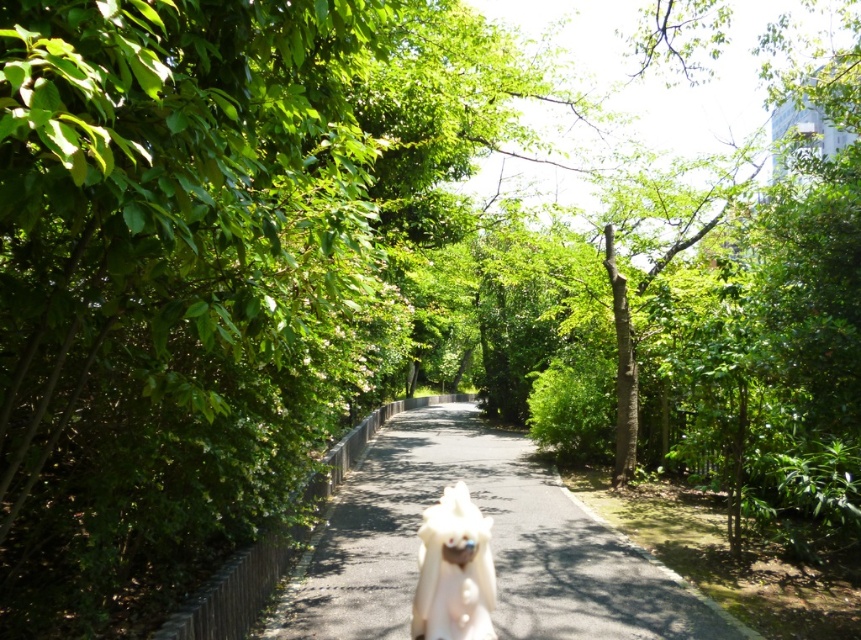
You are a child who wants to pick up both the white fabric dog at center and the white fur dog at center from the path. Which one do you need to bend down more to reach?

The white fur dog at center requires bending down more because it is shorter than the white fabric dog at center, which is much taller.

Consider the image. You are standing at the starting point of the pathway and see two points marked on the path. The first point is at coordinates point (671, 589) and the second point is at point (448, 552). Which point is closer to you?

Point (448, 552) is closer to you because it is in front of point (671, 589).

You are standing at the start of the pathway and see the white fabric dog at center. If you walk straight ahead along the path, will you eventually reach the point marked by point (x=488, y=545)?

Yes, because the point (x=488, y=545) marks the white fabric dog at center, so walking straight ahead along the path will lead you directly to it.